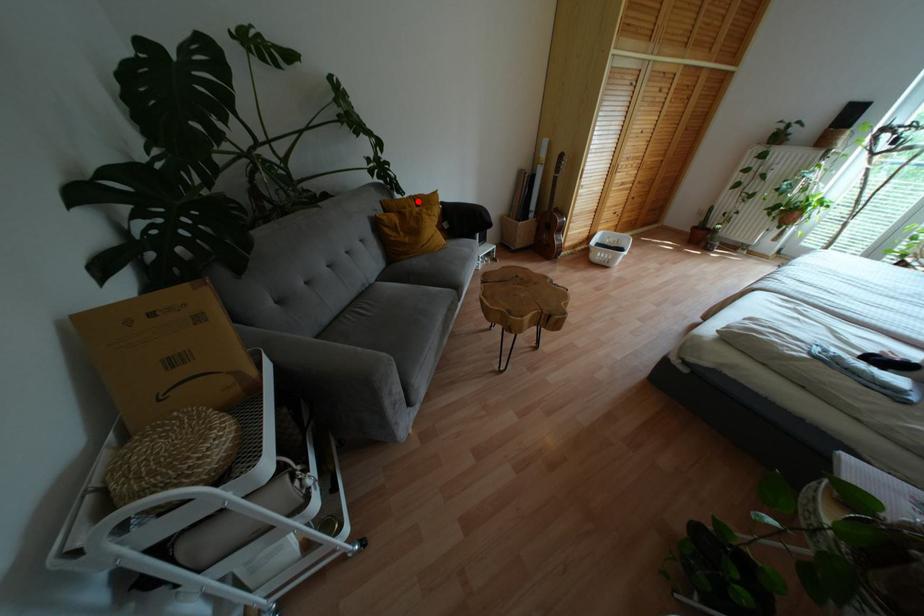
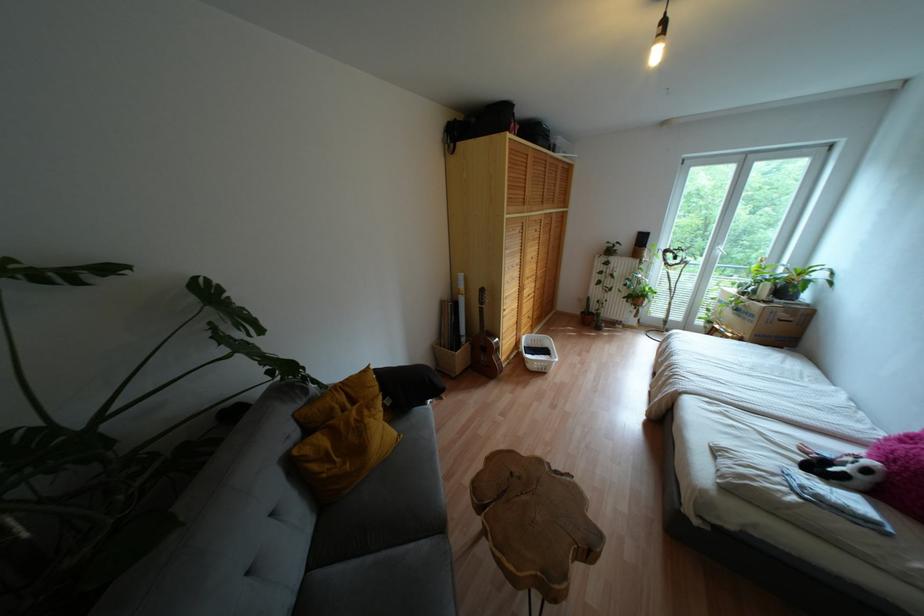
Question: I am providing you with two images of the same scene from different viewpoints. In image1, a red point is highlighted. Considering the same 3D point in image2, which of the following is correct?

Choices:
 (A) It is closer
 (B) It is farther

Answer: (B)